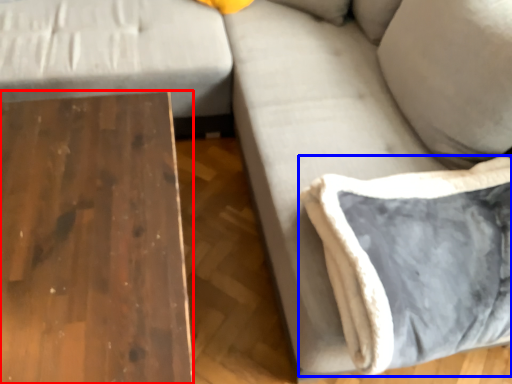
Question: Among these objects, which one is farthest to the camera, table (highlighted by a red box) or pillow (highlighted by a blue box)?

Choices:
 (A) table
 (B) pillow

Answer: (B)